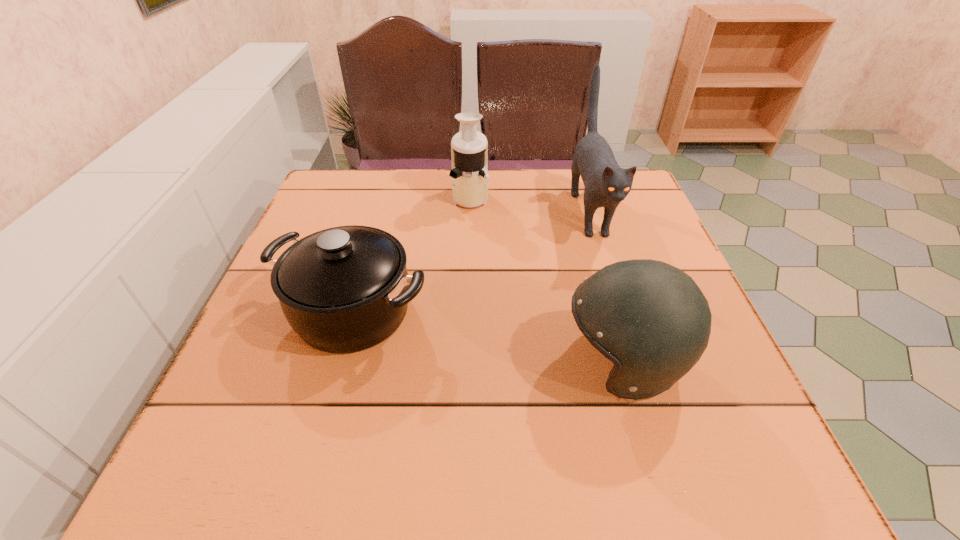
This screenshot has height=540, width=960. I want to click on vacant space at the right edge, so click(622, 251).

The width and height of the screenshot is (960, 540). I want to click on vacant space at the near left corner of the desktop, so tap(206, 464).

You are a GUI agent. You are given a task and a screenshot of the screen. Output one action in this format:
    pyautogui.click(x=<x>, y=<y>)
    Task: Click on the vacant space at the far right corner of the desktop
    
    Given the screenshot: What is the action you would take?
    pyautogui.click(x=597, y=214)

Where is `vacant space that is in between the tallest object and the third object from right to left`? The height and width of the screenshot is (540, 960). vacant space that is in between the tallest object and the third object from right to left is located at coordinates (530, 204).

The height and width of the screenshot is (540, 960). In order to click on empty space between the tallest object and the juicer in this screenshot , I will do `click(530, 204)`.

I want to click on unoccupied area between the juicer and the leftmost object, so click(412, 254).

You are a GUI agent. You are given a task and a screenshot of the screen. Output one action in this format:
    pyautogui.click(x=<x>, y=<y>)
    Task: Click on the free space between the leftmost object and the juicer
    The width and height of the screenshot is (960, 540).
    Given the screenshot: What is the action you would take?
    pyautogui.click(x=412, y=254)

Locate an element on the screen. The image size is (960, 540). free space between the cat and the saucepan is located at coordinates (471, 261).

You are a GUI agent. You are given a task and a screenshot of the screen. Output one action in this format:
    pyautogui.click(x=<x>, y=<y>)
    Task: Click on the free spot between the football helmet and the shortest object
    The image size is (960, 540).
    Given the screenshot: What is the action you would take?
    [488, 336]

Identify the location of empty space between the leftmost object and the second object from left to right. The width and height of the screenshot is (960, 540). (412, 254).